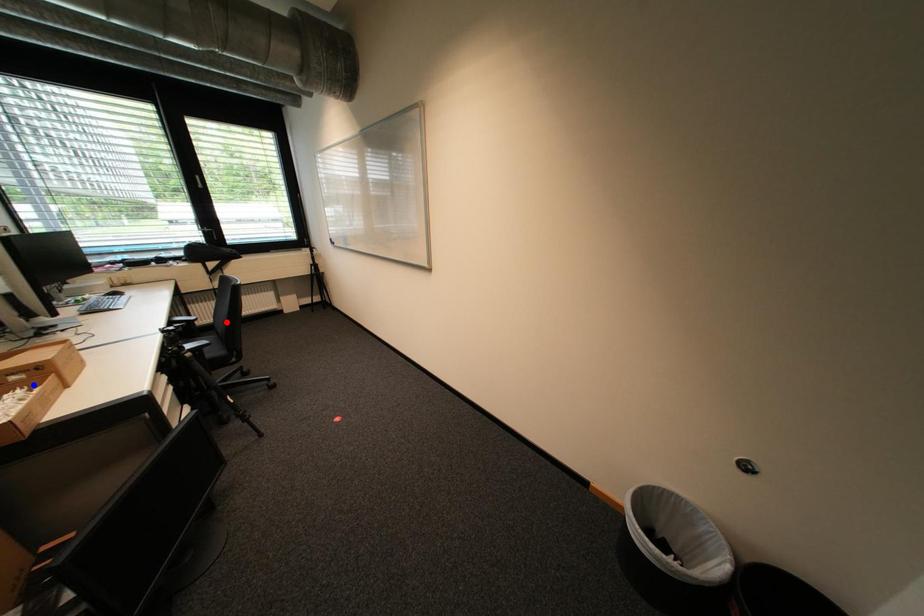
Question: In the image, two points are highlighted. Which point is nearer to the camera? Reply with the corresponding letter.

Choices:
 (A) blue point
 (B) red point

Answer: (A)